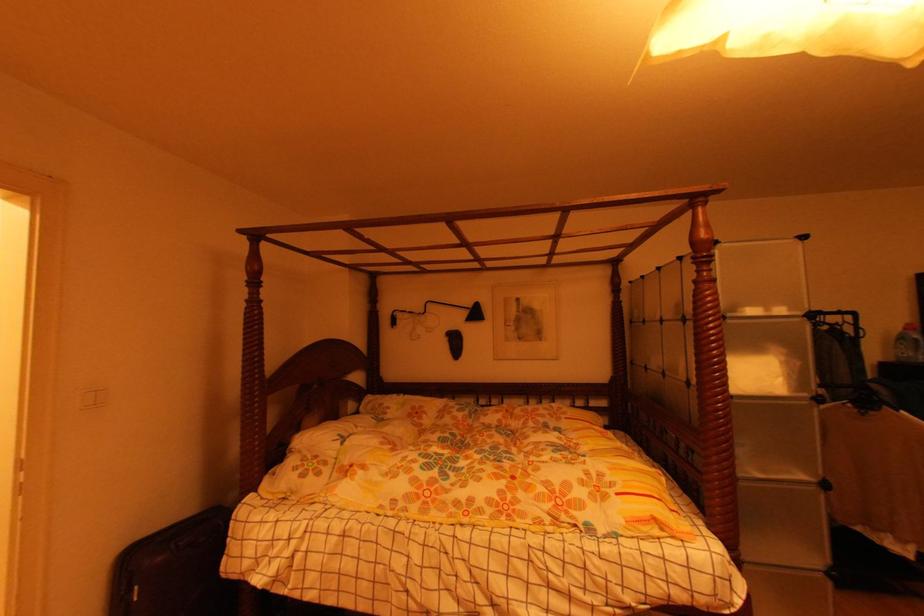
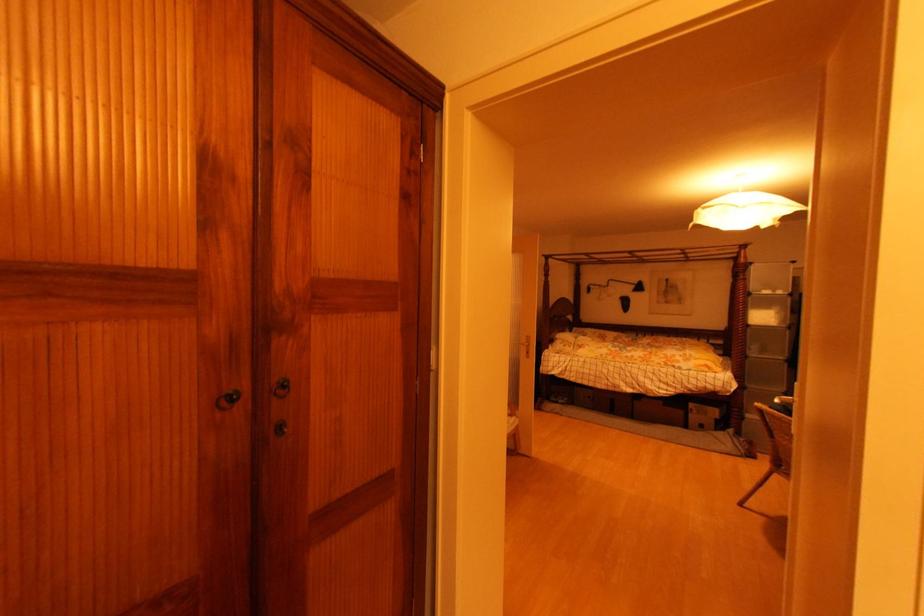
In the second image, find the point that corresponds to (x=755, y=472) in the first image.

(759, 355)